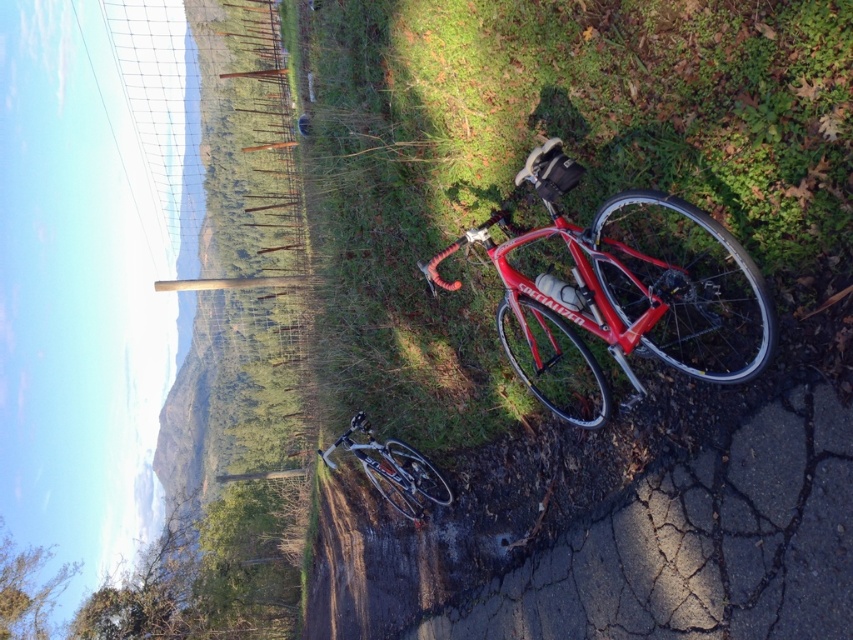
Question: Which point is farther to the camera?

Choices:
 (A) (325, 452)
 (B) (341, 337)

Answer: (A)

Question: Among these objects, which one is farthest from the camera?

Choices:
 (A) shiny red bicycle at center
 (B) shiny silver bicycle at center

Answer: (B)

Question: Can you confirm if green grass at center is positioned above shiny silver bicycle at center?

Choices:
 (A) yes
 (B) no

Answer: (A)

Question: Which of the following is the closest to the observer?

Choices:
 (A) (599, 324)
 (B) (366, 470)
 (C) (552, 490)

Answer: (A)

Question: Does shiny red bicycle at center appear on the left side of shiny silver bicycle at center?

Choices:
 (A) yes
 (B) no

Answer: (B)

Question: Is green grass at center below shiny silver bicycle at center?

Choices:
 (A) no
 (B) yes

Answer: (A)